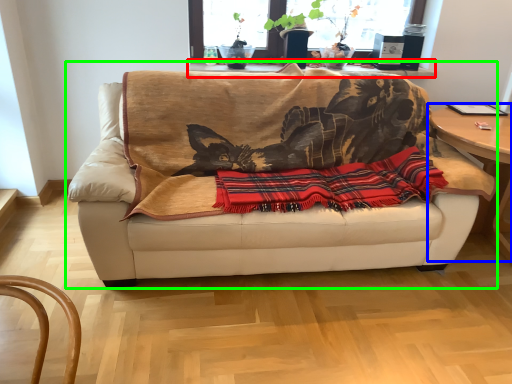
Question: Which object is positioned farthest from table (highlighted by a red box)? Select from table (highlighted by a blue box) and studio couch (highlighted by a green box).

Choices:
 (A) table
 (B) studio couch

Answer: (A)